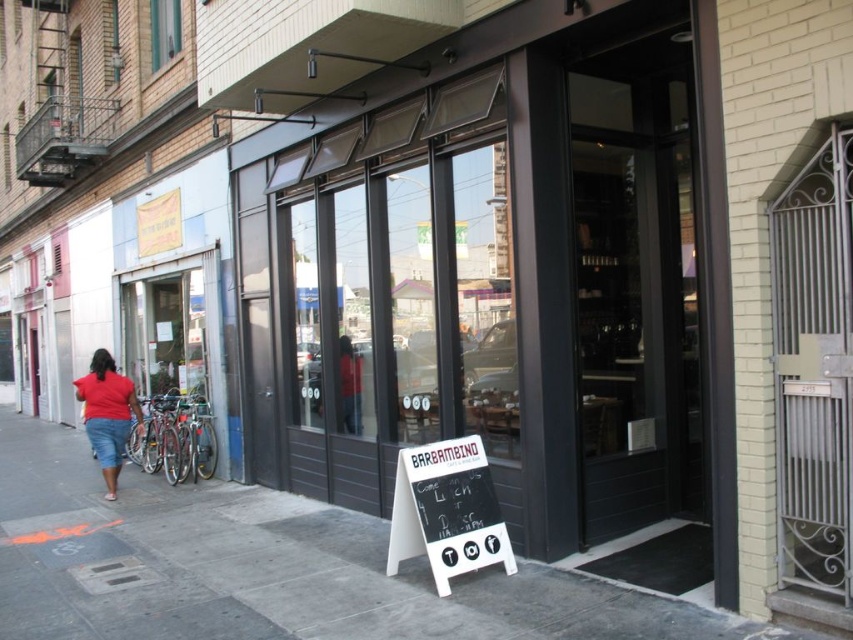
Can you confirm if matte black storefront at center is positioned to the left of matte red shirt at center?

No, matte black storefront at center is not to the left of matte red shirt at center.

Does matte black storefront at center have a greater height compared to matte red shirt at center?

Correct, matte black storefront at center is much taller as matte red shirt at center.

What do you see at coordinates (498, 253) in the screenshot? Image resolution: width=853 pixels, height=640 pixels. I see `matte black storefront at center` at bounding box center [498, 253].

Find the location of `matte black storefront at center`. matte black storefront at center is located at coordinates (498, 253).

Who is shorter, white wood sign at center or matte red shirt at left?

With less height is white wood sign at center.

Who is lower down, white wood sign at center or matte red shirt at left?

Positioned lower is white wood sign at center.

What do you see at coordinates (445, 512) in the screenshot? I see `white wood sign at center` at bounding box center [445, 512].

Locate an element on the screen. The width and height of the screenshot is (853, 640). white wood sign at center is located at coordinates coord(445,512).

Is clear glass window at upper left wider than matte red shirt at center?

Yes.

Between clear glass window at upper left and matte red shirt at center, which one appears on the right side from the viewer's perspective?

From the viewer's perspective, matte red shirt at center appears more on the right side.

Locate an element on the screen. clear glass window at upper left is located at coordinates (164, 29).